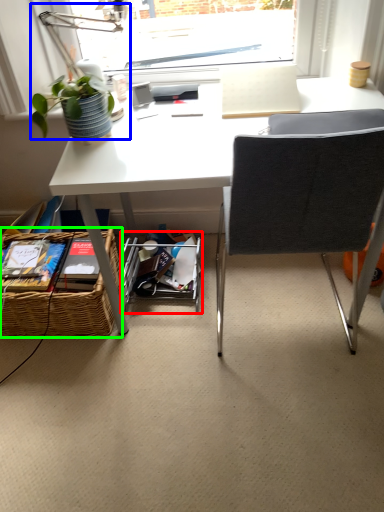
Question: Estimate the real-world distances between objects in this image. Which object is closer to shelf (highlighted by a red box), table lamp (highlighted by a blue box) or picnic basket (highlighted by a green box)?

Choices:
 (A) table lamp
 (B) picnic basket

Answer: (B)